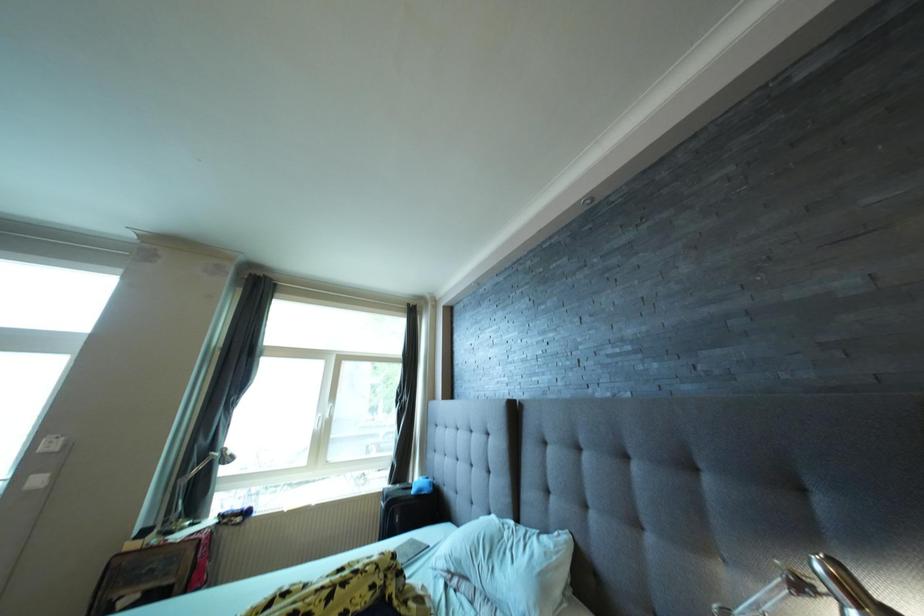
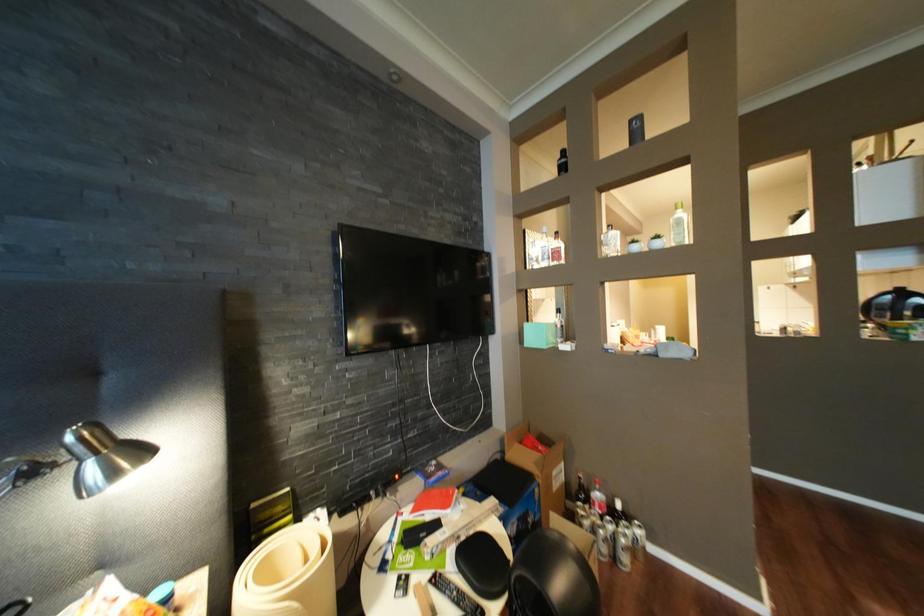
Question: The images are taken continuously from a first-person perspective. In which direction is your viewpoint rotating?

Choices:
 (A) Left
 (B) Right
 (C) Up
 (D) Down

Answer: (B)